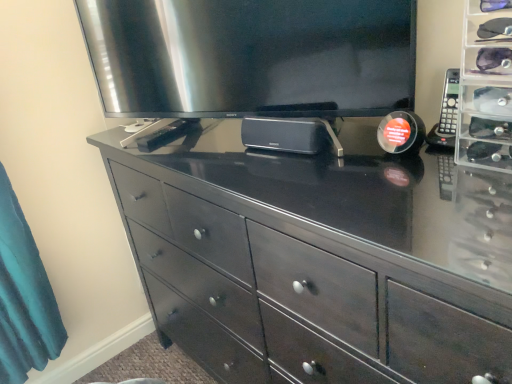
Question: Is black plastic remote at right located within satin silver television at upper center?

Choices:
 (A) no
 (B) yes

Answer: (A)

Question: From a real-world perspective, is satin silver television at upper center physically above black plastic remote at right?

Choices:
 (A) yes
 (B) no

Answer: (A)

Question: Is satin silver television at upper center at the left side of black plastic remote at right?

Choices:
 (A) no
 (B) yes

Answer: (B)

Question: Does satin silver television at upper center have a lesser height compared to black plastic remote at right?

Choices:
 (A) no
 (B) yes

Answer: (A)

Question: Does satin silver television at upper center lie in front of black plastic remote at right?

Choices:
 (A) no
 (B) yes

Answer: (B)

Question: From the image's perspective, is dark wood dresser at center above or below satin silver television at upper center?

Choices:
 (A) above
 (B) below

Answer: (B)

Question: Relative to satin silver television at upper center, is dark wood dresser at center in front or behind?

Choices:
 (A) front
 (B) behind

Answer: (A)

Question: Considering the positions of dark wood dresser at center and satin silver television at upper center in the image, is dark wood dresser at center taller or shorter than satin silver television at upper center?

Choices:
 (A) tall
 (B) short

Answer: (A)

Question: Is dark wood dresser at center inside or outside of satin silver television at upper center?

Choices:
 (A) inside
 (B) outside

Answer: (B)

Question: From a real-world perspective, is satin silver television at upper center above or below black plastic remote at right?

Choices:
 (A) below
 (B) above

Answer: (B)

Question: In the image, is satin silver television at upper center on the left side or the right side of black plastic remote at right?

Choices:
 (A) right
 (B) left

Answer: (B)

Question: Considering the positions of point (311, 52) and point (445, 89), is point (311, 52) closer or farther from the camera than point (445, 89)?

Choices:
 (A) closer
 (B) farther

Answer: (B)

Question: Relative to black plastic remote at right, is satin silver television at upper center in front or behind?

Choices:
 (A) behind
 (B) front

Answer: (B)

Question: In the image, is dark wood dresser at center positioned in front of or behind black plastic remote at right?

Choices:
 (A) behind
 (B) front

Answer: (B)

Question: From a real-world perspective, is dark wood dresser at center positioned above or below black plastic remote at right?

Choices:
 (A) below
 (B) above

Answer: (A)